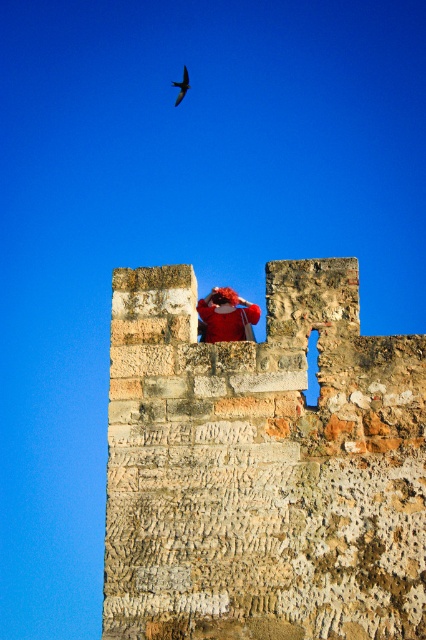
Measure the distance between rusty stone fort at center and smooth black bird at upper center.

rusty stone fort at center and smooth black bird at upper center are 332.17 feet apart from each other.

Who is more distant from viewer, (209, 499) or (175, 104)?

The point (175, 104) is more distant.

At what (x,y) coordinates should I click in order to perform the action: click on rusty stone fort at center. Please return your answer as a coordinate pair (x, y). The image size is (426, 640). Looking at the image, I should click on (261, 467).

Locate an element on the screen. rusty stone fort at center is located at coordinates (261, 467).